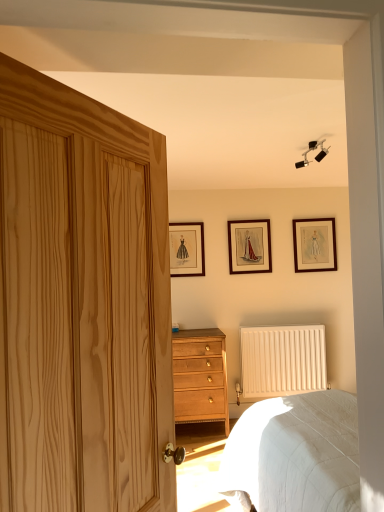
What do you see at coordinates (282, 360) in the screenshot? I see `white matte radiator at lower center` at bounding box center [282, 360].

The image size is (384, 512). Describe the element at coordinates (151, 209) in the screenshot. I see `natural wood door at left` at that location.

This screenshot has height=512, width=384. What do you see at coordinates (314, 245) in the screenshot?
I see `wooden picture frame at upper right, the third picture frame from the left` at bounding box center [314, 245].

What do you see at coordinates (249, 246) in the screenshot? The height and width of the screenshot is (512, 384). I see `matte black picture frame at center, the second picture frame positioned from the left` at bounding box center [249, 246].

Image resolution: width=384 pixels, height=512 pixels. Find the location of `white quilted bed at lower right`. white quilted bed at lower right is located at coordinates (295, 454).

In order to face white quilted bed at lower right, should I rotate leftwards or rightwards?

You should look right and rotate roughly 20.615 degrees.

What are the coordinates of `light wood/texture chest of drawers at center` in the screenshot? It's located at (200, 376).

Find the location of `white matte radiator at lower center`. white matte radiator at lower center is located at coordinates (282, 360).

Is white quilted bed at lower right facing away from natural wood door at left?

No.

Is white quilted bed at lower right positioned before natural wood door at left?

No, white quilted bed at lower right is further to the viewer.

Which object is wider, white quilted bed at lower right or natural wood door at left?

white quilted bed at lower right.

From a real-world perspective, which is physically below, white quilted bed at lower right or natural wood door at left?

white quilted bed at lower right is physically lower.

Does light wood/texture chest of drawers at center have a larger size compared to matte black picture frame at center, which is the second picture frame in right-to-left order?

Indeed, light wood/texture chest of drawers at center has a larger size compared to matte black picture frame at center, which is the second picture frame in right-to-left order.

Does light wood/texture chest of drawers at center lie in front of matte black picture frame at center, the second picture frame positioned from the left?

Yes, it is.

Which object is thinner, light wood/texture chest of drawers at center or matte black picture frame at center, which is the second picture frame in right-to-left order?

matte black picture frame at center, which is the second picture frame in right-to-left order, is thinner.

Is light wood/texture chest of drawers at center in contact with matte black picture frame at center, which is the second picture frame in right-to-left order?

No, light wood/texture chest of drawers at center is not beside matte black picture frame at center, which is the second picture frame in right-to-left order.

Is light wood/texture chest of drawers at center in front of or behind natural wood door at left in the image?

Clearly, light wood/texture chest of drawers at center is behind natural wood door at left.

Consider the image. Considering the relative sizes of light wood/texture chest of drawers at center and natural wood door at left in the image provided, is light wood/texture chest of drawers at center shorter than natural wood door at left?

Yes.

How distant is light wood/texture chest of drawers at center from natural wood door at left?

light wood/texture chest of drawers at center and natural wood door at left are 2.51 meters apart from each other.

In the scene shown: Is light wood/texture chest of drawers at center oriented towards natural wood door at left?

Yes, light wood/texture chest of drawers at center faces towards natural wood door at left.

Based on the photo, from a real-world perspective, which is physically above, white matte radiator at lower center or matte black picture frame at center, which is the second picture frame in right-to-left order?

matte black picture frame at center, which is the second picture frame in right-to-left order, is physically above.

Would you say white matte radiator at lower center is a long distance from matte black picture frame at center, which is the second picture frame in right-to-left order?

No, white matte radiator at lower center is in close proximity to matte black picture frame at center, which is the second picture frame in right-to-left order.

How many degrees apart are the facing directions of white matte radiator at lower center and matte black picture frame at center, the second picture frame positioned from the left?

The angle between the facing direction of white matte radiator at lower center and the facing direction of matte black picture frame at center, the second picture frame positioned from the left, is 0.0158 degrees.

From the image's perspective, is white matte radiator at lower center above matte black picture frame at center, the second picture frame positioned from the left?

No, from the image's perspective, white matte radiator at lower center is not over matte black picture frame at center, the second picture frame positioned from the left.

Between white matte radiator at lower center and black matte track light at upper center, which one has smaller width?

black matte track light at upper center.

Is white matte radiator at lower center positioned before black matte track light at upper center?

No.

Is white matte radiator at lower center at the left side of black matte track light at upper center?

No.

From the image's perspective, relative to black matte track light at upper center, is white matte radiator at lower center above or below?

Based on their image positions, white matte radiator at lower center is located beneath black matte track light at upper center.

Between black matte track light at upper center and wooden picture frame at upper right, the first picture frame from the right, which one appears on the right side from the viewer's perspective?

Positioned to the right is wooden picture frame at upper right, the first picture frame from the right.

From the picture: Which object is thinner, black matte track light at upper center or wooden picture frame at upper right, the first picture frame from the right?

With smaller width is wooden picture frame at upper right, the first picture frame from the right.

Can you confirm if black matte track light at upper center is taller than wooden picture frame at upper right, the first picture frame from the right?

No.

From the picture: Would you consider black matte track light at upper center to be distant from wooden picture frame at upper right, the first picture frame from the right?

black matte track light at upper center is positioned a significant distance from wooden picture frame at upper right, the first picture frame from the right.

From the image's perspective, is black matte track light at upper center located above or below light wood/texture chest of drawers at center?

black matte track light at upper center is above light wood/texture chest of drawers at center.

Which is less distant, (322, 154) or (204, 421)?

The point (322, 154) is closer.

Does black matte track light at upper center have a greater height compared to light wood/texture chest of drawers at center?

Incorrect, the height of black matte track light at upper center is not larger of that of light wood/texture chest of drawers at center.

From a real-world perspective, is black matte track light at upper center above or below light wood/texture chest of drawers at center?

black matte track light at upper center is above light wood/texture chest of drawers at center.

I want to click on door lying in front of the white quilted bed at lower right, so click(151, 209).

I want to click on the 1st picture frame to the right of the light wood/texture chest of drawers at center, counting from the anchor's position, so click(x=249, y=246).

Based on their spatial positions, is matte black picture frame at upper left, which is the 3th picture frame in right-to-left order, or white matte radiator at lower center closer to white quilted bed at lower right?

Among the two, white matte radiator at lower center is located nearer to white quilted bed at lower right.

Estimate the real-world distances between objects in this image. Which object is further from matte black picture frame at upper left, the first picture frame when ordered from left to right, white quilted bed at lower right or wooden picture frame at upper right, the third picture frame from the left?

white quilted bed at lower right.

Considering their positions, is natural wood door at left positioned further to wooden picture frame at upper right, the first picture frame from the right, than light wood/texture chest of drawers at center?

The object further to wooden picture frame at upper right, the first picture frame from the right, is natural wood door at left.

From the image, which object appears to be nearer to white quilted bed at lower right, white matte radiator at lower center or natural wood door at left?

natural wood door at left is closer to white quilted bed at lower right.

Estimate the real-world distances between objects in this image. Which object is further from wooden picture frame at upper right, the third picture frame from the left, matte black picture frame at center, which is the second picture frame in right-to-left order, or black matte track light at upper center?

black matte track light at upper center is further to wooden picture frame at upper right, the third picture frame from the left.

When comparing their distances from natural wood door at left, does matte black picture frame at center, which is the second picture frame in right-to-left order, or white quilted bed at lower right seem closer?

Based on the image, white quilted bed at lower right appears to be nearer to natural wood door at left.

Based on their spatial positions, is natural wood door at left or white quilted bed at lower right further from light wood/texture chest of drawers at center?

natural wood door at left lies further to light wood/texture chest of drawers at center than the other object.

Looking at the image, which one is located closer to matte black picture frame at upper left, which is the 3th picture frame in right-to-left order, matte black picture frame at center, the second picture frame positioned from the left, or white matte radiator at lower center?

matte black picture frame at center, the second picture frame positioned from the left.

Identify the location of lamp between natural wood door at left and matte black picture frame at upper left, which is the 3th picture frame in right-to-left order, along the z-axis. (313, 150).

Identify the location of radiator located between white quilted bed at lower right and wooden picture frame at upper right, the first picture frame from the right, in the depth direction. (282, 360).

You are a GUI agent. You are given a task and a screenshot of the screen. Output one action in this format:
    pyautogui.click(x=<x>, y=<y>)
    Task: Click on the bed located between natural wood door at left and matte black picture frame at upper left, the first picture frame when ordered from left to right, in the depth direction
    The height and width of the screenshot is (512, 384).
    Given the screenshot: What is the action you would take?
    pyautogui.click(x=295, y=454)

At what (x,y) coordinates should I click in order to perform the action: click on lamp located between natural wood door at left and white matte radiator at lower center in the depth direction. Please return your answer as a coordinate pair (x, y). Looking at the image, I should click on (313, 150).